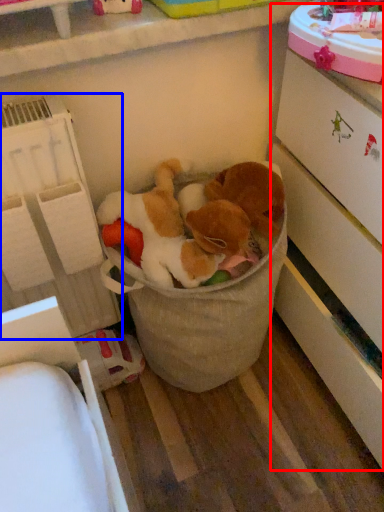
Question: Among these objects, which one is farthest to the camera, cabinetry (highlighted by a red box) or shelf (highlighted by a blue box)?

Choices:
 (A) cabinetry
 (B) shelf

Answer: (B)